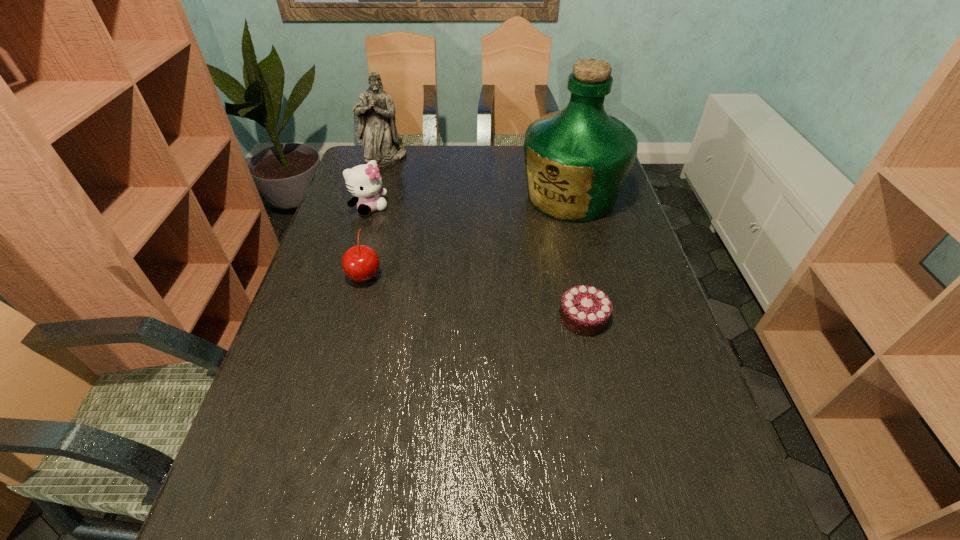
Locate an element on the screen. liquor that is at the far edge is located at coordinates (577, 160).

Where is `cherry present at the left edge`? The height and width of the screenshot is (540, 960). cherry present at the left edge is located at coordinates (360, 263).

At what (x,y) coordinates should I click in order to perform the action: click on figurine at the left edge. Please return your answer as a coordinate pair (x, y). This screenshot has width=960, height=540. Looking at the image, I should click on (376, 112).

At what (x,y) coordinates should I click in order to perform the action: click on kitten that is at the left edge. Please return your answer as a coordinate pair (x, y). Image resolution: width=960 pixels, height=540 pixels. Looking at the image, I should click on (364, 181).

The width and height of the screenshot is (960, 540). What are the coordinates of `chocolate cake that is at the right edge` in the screenshot? It's located at (585, 310).

Identify the location of liquor that is at the right edge. The height and width of the screenshot is (540, 960). (577, 160).

Find the location of `object that is at the far left corner`. object that is at the far left corner is located at coordinates (376, 112).

This screenshot has height=540, width=960. I want to click on object that is at the far right corner, so click(577, 160).

At what (x,y) coordinates should I click in order to perform the action: click on vacant region at the far edge of the desktop. Please return your answer as a coordinate pair (x, y). This screenshot has width=960, height=540. Looking at the image, I should click on (428, 155).

The image size is (960, 540). I want to click on vacant region at the near edge of the desktop, so click(x=625, y=485).